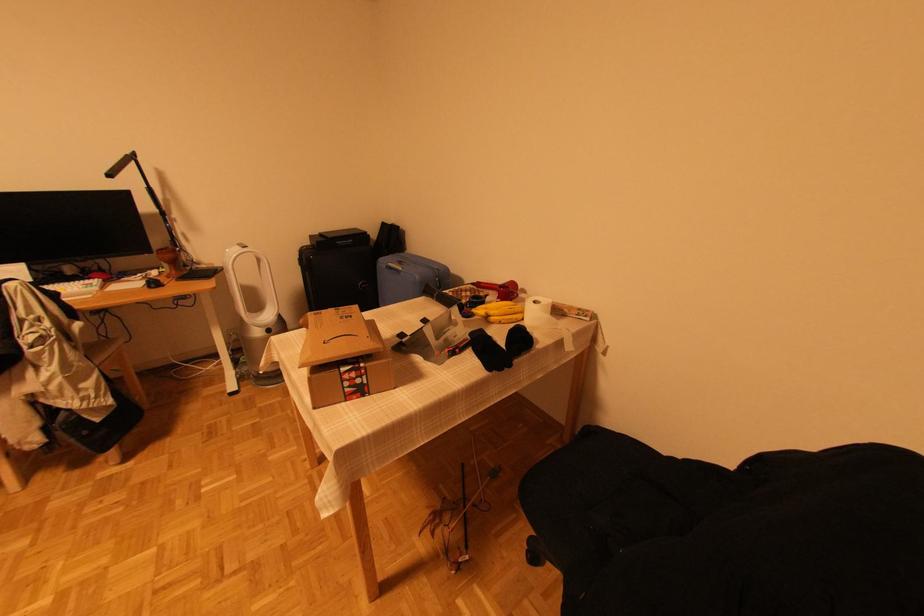
Locate an element on the screen. The image size is (924, 616). chair sitting surface is located at coordinates pyautogui.click(x=103, y=349).